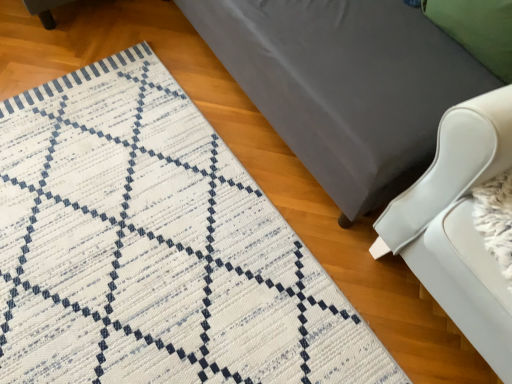
Question: Is green fabric pillow at upper right facing towards matte gray bed at center?

Choices:
 (A) no
 (B) yes

Answer: (B)

Question: Is matte gray bed at center located within green fabric pillow at upper right?

Choices:
 (A) yes
 (B) no

Answer: (B)

Question: Considering the relative sizes of green fabric pillow at upper right and matte gray bed at center in the image provided, is green fabric pillow at upper right smaller than matte gray bed at center?

Choices:
 (A) no
 (B) yes

Answer: (B)

Question: Would you say green fabric pillow at upper right is outside matte gray bed at center?

Choices:
 (A) yes
 (B) no

Answer: (B)

Question: Does green fabric pillow at upper right have a greater height compared to matte gray bed at center?

Choices:
 (A) yes
 (B) no

Answer: (B)

Question: Is green fabric pillow at upper right far from matte gray bed at center?

Choices:
 (A) yes
 (B) no

Answer: (B)

Question: Can you confirm if matte gray bed at center is wider than white woven mat at lower left?

Choices:
 (A) no
 (B) yes

Answer: (A)

Question: Is matte gray bed at center positioned behind white woven mat at lower left?

Choices:
 (A) no
 (B) yes

Answer: (A)

Question: Is matte gray bed at center aimed at white woven mat at lower left?

Choices:
 (A) no
 (B) yes

Answer: (B)

Question: Is matte gray bed at center shorter than white woven mat at lower left?

Choices:
 (A) yes
 (B) no

Answer: (B)

Question: Considering the relative sizes of matte gray bed at center and white woven mat at lower left in the image provided, is matte gray bed at center thinner than white woven mat at lower left?

Choices:
 (A) no
 (B) yes

Answer: (B)

Question: Is matte gray bed at center bigger than white woven mat at lower left?

Choices:
 (A) no
 (B) yes

Answer: (B)

Question: From the image's perspective, is white woven mat at lower left over matte gray bed at center?

Choices:
 (A) no
 (B) yes

Answer: (A)